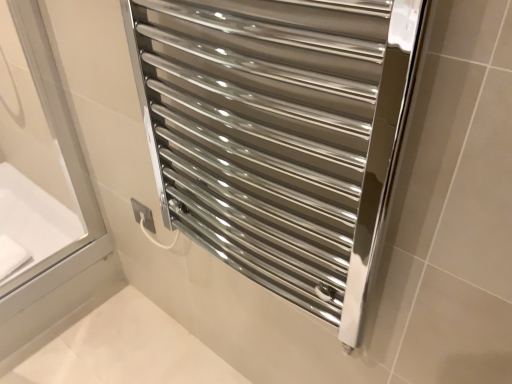
Question: Is polished chrome towel rack at center wider or thinner than white glossy bathtub at left?

Choices:
 (A) thin
 (B) wide

Answer: (A)

Question: In terms of height, does polished chrome towel rack at center look taller or shorter compared to white glossy bathtub at left?

Choices:
 (A) tall
 (B) short

Answer: (A)

Question: Is polished chrome towel rack at center to the left or to the right of white glossy bathtub at left in the image?

Choices:
 (A) right
 (B) left

Answer: (A)

Question: From a real-world perspective, is white glossy bathtub at left physically located above or below polished chrome towel rack at center?

Choices:
 (A) below
 (B) above

Answer: (A)

Question: In the image, is white glossy bathtub at left positioned in front of or behind polished chrome towel rack at center?

Choices:
 (A) behind
 (B) front

Answer: (A)

Question: Considering the positions of white glossy bathtub at left and polished chrome towel rack at center in the image, is white glossy bathtub at left wider or thinner than polished chrome towel rack at center?

Choices:
 (A) wide
 (B) thin

Answer: (A)

Question: Is point (13, 233) closer or farther from the camera than point (168, 173)?

Choices:
 (A) farther
 (B) closer

Answer: (A)